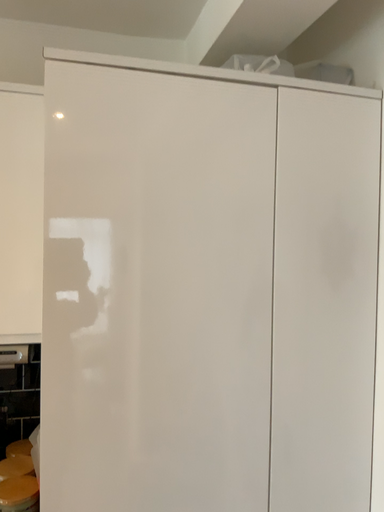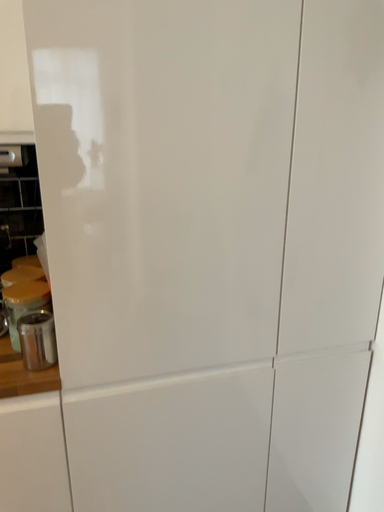
Question: Which way did the camera rotate in the video?

Choices:
 (A) rotated upward
 (B) rotated downward

Answer: (B)